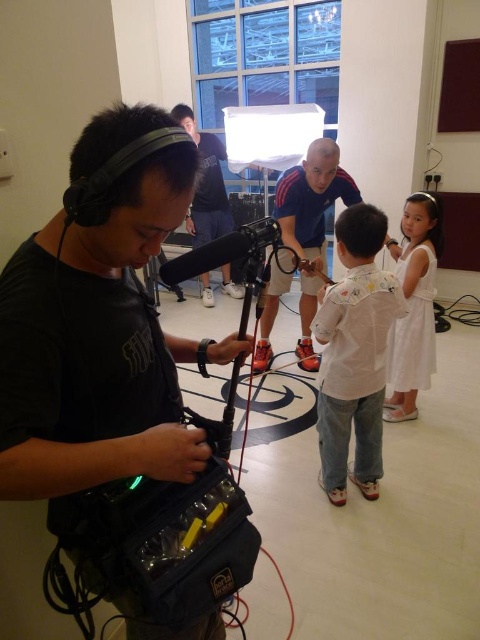
Is white cotton shirt at center to the right of matte black microphone at center from the viewer's perspective?

Indeed, white cotton shirt at center is positioned on the right side of matte black microphone at center.

At what (x,y) coordinates should I click in order to perform the action: click on white cotton shirt at center. Please return your answer as a coordinate pair (x, y). Looking at the image, I should click on (355, 355).

Consider the image. Is reddish-brown leather jacket at center to the right of smooth beige shirt at center from the viewer's perspective?

Yes, reddish-brown leather jacket at center is to the right of smooth beige shirt at center.

Is reddish-brown leather jacket at center thinner than smooth beige shirt at center?

In fact, reddish-brown leather jacket at center might be wider than smooth beige shirt at center.

The width and height of the screenshot is (480, 640). Describe the element at coordinates (302, 241) in the screenshot. I see `reddish-brown leather jacket at center` at that location.

I want to click on reddish-brown leather jacket at center, so click(x=302, y=241).

Between point (60, 490) and point (344, 230), which one is positioned behind?

Positioned behind is point (344, 230).

Measure the distance from black matte headphones at left to white cotton shirt at center.

black matte headphones at left and white cotton shirt at center are 1.23 meters apart from each other.

Who is more distant from viewer, (143,454) or (354,330)?

The point (354,330) is more distant.

The image size is (480, 640). What are the coordinates of `black matte headphones at left` in the screenshot? It's located at (97, 346).